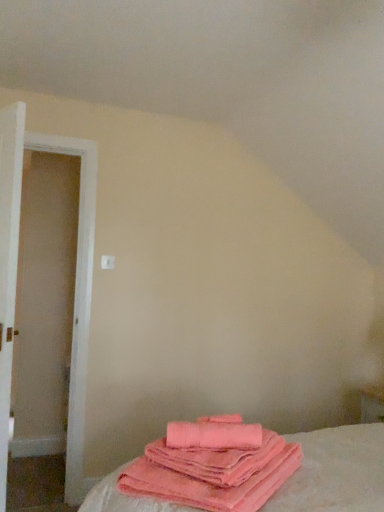
Question: From a real-world perspective, is pink soft cotton towels at lower center under pink plush towels at lower center?

Choices:
 (A) yes
 (B) no

Answer: (B)

Question: Can we say pink soft cotton towels at lower center lies outside pink plush towels at lower center?

Choices:
 (A) yes
 (B) no

Answer: (A)

Question: Does pink soft cotton towels at lower center appear on the left side of pink plush towels at lower center?

Choices:
 (A) no
 (B) yes

Answer: (B)

Question: From a real-world perspective, does pink soft cotton towels at lower center stand above pink plush towels at lower center?

Choices:
 (A) yes
 (B) no

Answer: (A)

Question: Does pink soft cotton towels at lower center have a greater height compared to pink plush towels at lower center?

Choices:
 (A) yes
 (B) no

Answer: (B)

Question: Considering the positions of point (84, 272) and point (235, 441), is point (84, 272) closer or farther from the camera than point (235, 441)?

Choices:
 (A) closer
 (B) farther

Answer: (B)

Question: From the image's perspective, is white wooden door at left located above or below pink soft cotton towels at lower center?

Choices:
 (A) above
 (B) below

Answer: (A)

Question: Is white wooden door at left to the left or to the right of pink soft cotton towels at lower center in the image?

Choices:
 (A) left
 (B) right

Answer: (A)

Question: Considering the positions of white wooden door at left and pink soft cotton towels at lower center in the image, is white wooden door at left wider or thinner than pink soft cotton towels at lower center?

Choices:
 (A) wide
 (B) thin

Answer: (B)

Question: In terms of height, does pink plush towels at lower center look taller or shorter compared to white wooden door at left?

Choices:
 (A) tall
 (B) short

Answer: (B)

Question: From the image's perspective, relative to white wooden door at left, is pink plush towels at lower center above or below?

Choices:
 (A) above
 (B) below

Answer: (B)

Question: Would you say pink plush towels at lower center is to the left or to the right of white wooden door at left in the picture?

Choices:
 (A) right
 (B) left

Answer: (A)

Question: In terms of width, does pink plush towels at lower center look wider or thinner when compared to white wooden door at left?

Choices:
 (A) wide
 (B) thin

Answer: (A)

Question: In terms of width, does white wooden door at left look wider or thinner when compared to pink plush towels at lower center?

Choices:
 (A) thin
 (B) wide

Answer: (A)

Question: From their relative heights in the image, would you say white wooden door at left is taller or shorter than pink plush towels at lower center?

Choices:
 (A) tall
 (B) short

Answer: (A)